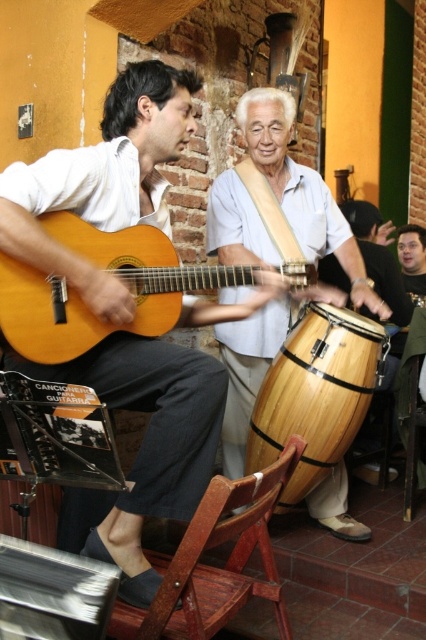
Between natural wood drum at center and wooden drum at center, which one has less height?

With less height is wooden drum at center.

Is point (233, 355) positioned before point (368, 209)?

Yes, point (233, 355) is in front of point (368, 209).

Find the location of `natural wood drum at center`. natural wood drum at center is located at coordinates (302, 189).

Which is in front, point (175, 268) or point (389, 371)?

Point (175, 268) is in front.

Between matte wood guitar at center and wooden drum at center, which one is positioned lower?

matte wood guitar at center

Identify the location of matte wood guitar at center. Image resolution: width=426 pixels, height=640 pixels. (103, 273).

This screenshot has height=640, width=426. I want to click on matte wood guitar at center, so click(103, 273).

Describe the element at coordinates (302, 189) in the screenshot. The image size is (426, 640). I see `natural wood drum at center` at that location.

Can you confirm if natural wood drum at center is positioned below matte wood guitar at center?

Incorrect, natural wood drum at center is not positioned below matte wood guitar at center.

Is point (242, 438) less distant than point (22, 292)?

No, it is not.

In order to click on natural wood drum at center in this screenshot , I will do `click(302, 189)`.